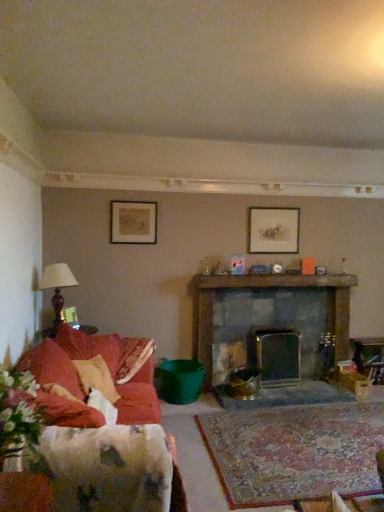
Question: Is matte silver picture frame at upper center, positioned as the 2th picture frame in top-to-bottom order, bigger or smaller than matte brown lamp at left?

Choices:
 (A) small
 (B) big

Answer: (A)

Question: Looking at their shapes, would you say matte silver picture frame at upper center, which ranks as the third picture frame in front-to-back order, is wider or thinner than matte brown lamp at left?

Choices:
 (A) thin
 (B) wide

Answer: (A)

Question: Which of these objects is positioned farthest from the dark gray stone fireplace at center, which is counted as the second fireplace, starting from the right?

Choices:
 (A) velvet red couch at left
 (B) matte silver picture frame at upper center, positioned as the 2th picture frame in top-to-bottom order
 (C) metallic silver fireplace at center, positioned as the 2th fireplace in left-to-right order
 (D) matte black picture frame at upper left, which ranks as the 2th picture frame in right-to-left order
 (E) matte gold picture frame at left, the first picture frame when ordered from bottom to top

Answer: (E)

Question: Based on their relative distances, which object is farther from the velvet red couch at left?

Choices:
 (A) matte black picture frame at upper left, which ranks as the 2th picture frame in right-to-left order
 (B) dark gray stone fireplace at center, which is counted as the second fireplace, starting from the right
 (C) metallic silver fireplace at center, the first fireplace positioned from the right
 (D) matte gold picture frame at left, which appears as the third picture frame when viewed from the back
 (E) matte brown lamp at left

Answer: (C)